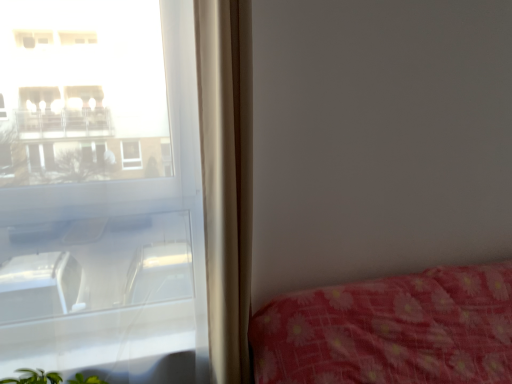
Question: Is point (35, 248) closer or farther from the camera than point (233, 49)?

Choices:
 (A) closer
 (B) farther

Answer: (B)

Question: Do you think transparent glass window at left is within beige fabric curtain at left, or outside of it?

Choices:
 (A) inside
 (B) outside

Answer: (B)

Question: From a real-world perspective, relative to beige fabric curtain at left, is transparent glass window at left vertically above or below?

Choices:
 (A) below
 (B) above

Answer: (A)

Question: In terms of width, does beige fabric curtain at left look wider or thinner when compared to transparent glass window at left?

Choices:
 (A) thin
 (B) wide

Answer: (B)

Question: From the image's perspective, relative to transparent glass window at left, is beige fabric curtain at left above or below?

Choices:
 (A) below
 (B) above

Answer: (B)

Question: Is beige fabric curtain at left taller or shorter than transparent glass window at left?

Choices:
 (A) tall
 (B) short

Answer: (B)

Question: Looking at the image, does beige fabric curtain at left seem bigger or smaller compared to transparent glass window at left?

Choices:
 (A) small
 (B) big

Answer: (A)